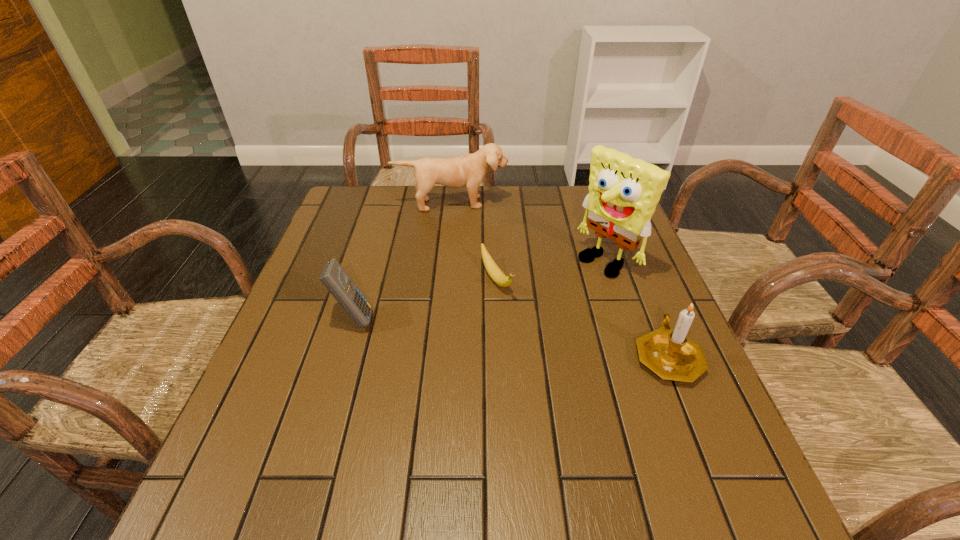
Identify the location of calculator. The image size is (960, 540). (333, 276).

Identify the location of candle holder. This screenshot has width=960, height=540. (670, 354).

I want to click on the tallest object, so click(x=623, y=192).

Locate an element on the screen. This screenshot has height=540, width=960. puppy is located at coordinates (468, 170).

The width and height of the screenshot is (960, 540). I want to click on banana, so click(493, 270).

Image resolution: width=960 pixels, height=540 pixels. I want to click on vacant area situated 0.210m on the front-facing side of the calculator, so click(466, 319).

What are the coordinates of `vacant area situated on the back of the candle holder` in the screenshot? It's located at (625, 251).

Locate an element on the screen. The height and width of the screenshot is (540, 960). free space located 0.050m on the face of the sponge is located at coordinates (576, 282).

You are a GUI agent. You are given a task and a screenshot of the screen. Output one action in this format:
    pyautogui.click(x=<x>, y=<y>)
    Task: Click on the free spot located 0.260m on the face of the sponge
    The height and width of the screenshot is (540, 960).
    Given the screenshot: What is the action you would take?
    [x=516, y=323]

You are a GUI agent. You are given a task and a screenshot of the screen. Output one action in this format:
    pyautogui.click(x=<x>, y=<y>)
    Task: Click on the free space located 0.110m on the face of the sponge
    This screenshot has height=540, width=960.
    Given the screenshot: What is the action you would take?
    pyautogui.click(x=561, y=293)